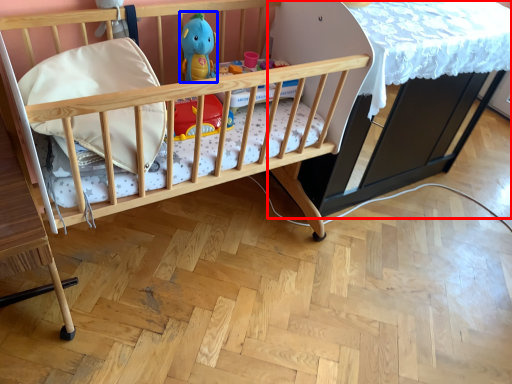
Question: Which object appears closest to the camera in this image, table (highlighted by a red box) or toy (highlighted by a blue box)?

Choices:
 (A) table
 (B) toy

Answer: (A)